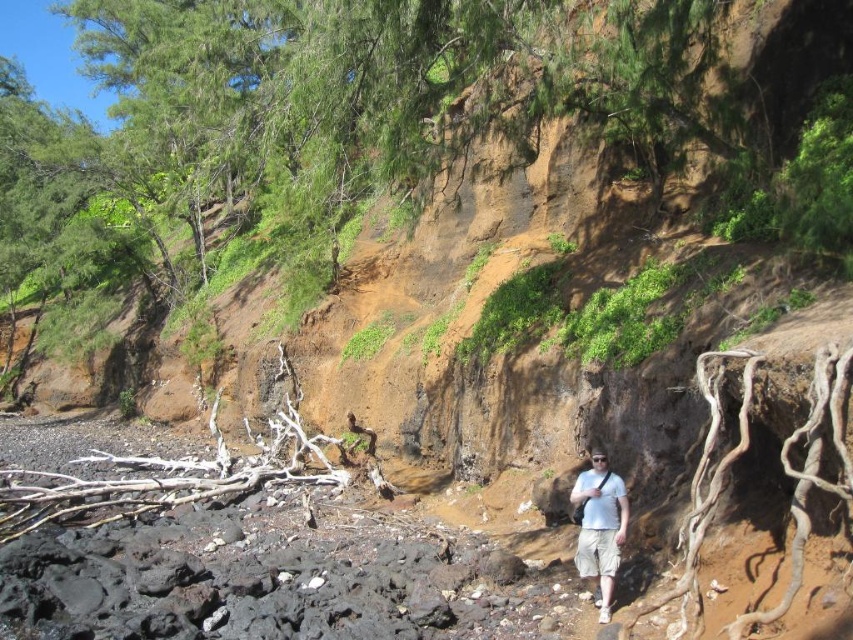
You are a hiker who has just arrived at the cliff area. You see a brown rough tree root at lower left and a white cotton shirt at lower right. Which object is taller?

The brown rough tree root at lower left is much taller than the white cotton shirt at lower right.

You are a hiker who wants to cross from the lower left to the lower right of the scene. There is a brown rough tree root at lower left and a white cotton shirt at lower right. Which object is bigger in size?

The brown rough tree root at lower left is larger in size compared to the white cotton shirt at lower right according to the description.

You are standing at point (596, 470) and want to walk to point (254, 484). Based on the landscape description, will you have to climb over any obstacles along the way?

Yes, you will have to climb over obstacles because point (254, 484) is behind point (596, 470), which suggests there might be terrain features like rocks or cliffs blocking the direct path between them.